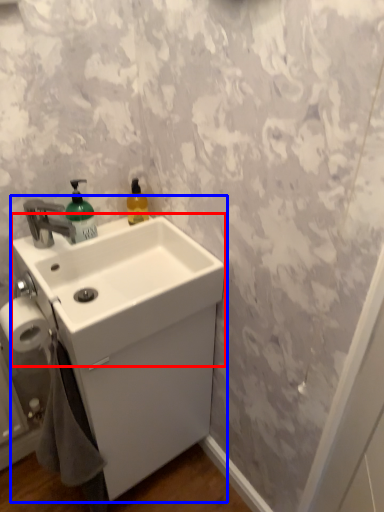
Question: Among these objects, which one is farthest to the camera, counter top (highlighted by a red box) or sink (highlighted by a blue box)?

Choices:
 (A) counter top
 (B) sink

Answer: (B)